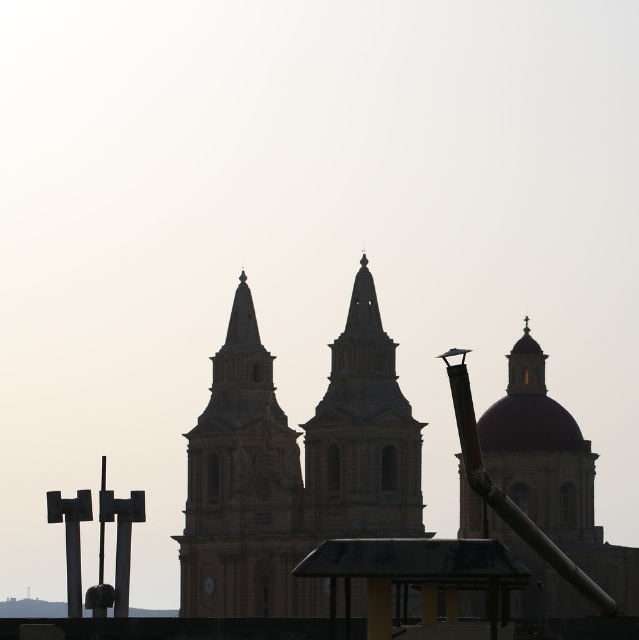
Who is taller, beige stone church at center or beige stone tower at center?

beige stone church at center is taller.

Does beige stone church at center appear under beige stone tower at center?

No, beige stone church at center is not below beige stone tower at center.

Which is behind, point (343, 486) or point (250, 368)?

The point (250, 368) is more distant.

In order to click on beige stone church at center in this screenshot , I will do `click(293, 467)`.